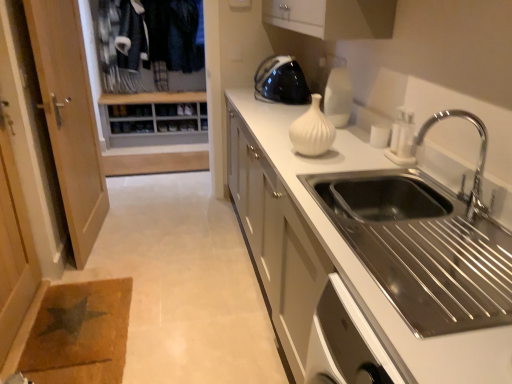
In order to click on free space in front of black glossy kettle at upper center in this screenshot , I will do `click(271, 111)`.